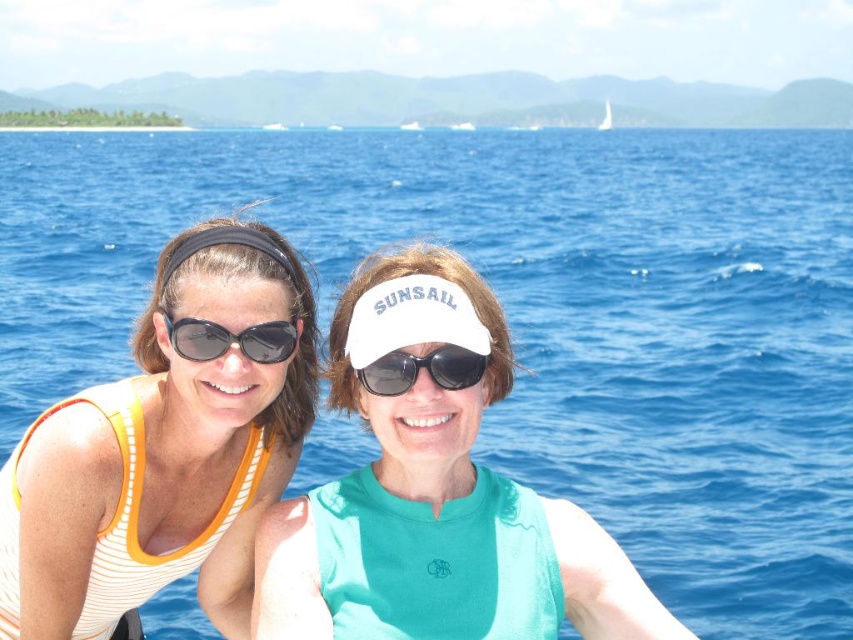
You are a photographer trying to focus on the white striped tank top at left. According to the coordinates provided, where should you adjust your camera lens to aim precisely?

The white striped tank top at left is located at coordinates point [166,444], so you should adjust your camera lens to aim precisely at that point.

You are a photographer trying to capture a closeup shot of the white striped tank top at left and the matte black sunglasses at center. Given that your camera has a depth of field that can focus on objects within 3 feet of each other, will both items be in focus?

The white striped tank top at left and matte black sunglasses at center are 3.81 feet apart from each other. Since the distance between them exceeds the camera lens depth of field range of 3 feet, both items cannot be in focus simultaneously.